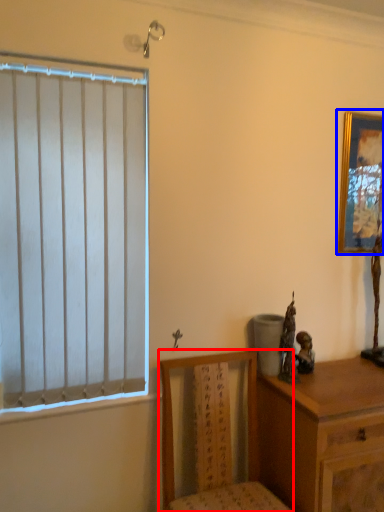
Question: Which of the following is the farthest to the observer, chair (highlighted by a red box) or picture frame (highlighted by a blue box)?

Choices:
 (A) chair
 (B) picture frame

Answer: (B)